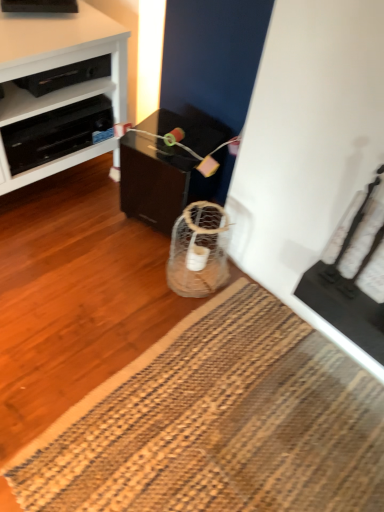
The image size is (384, 512). In order to click on free spot in front of black glossy table at center in this screenshot , I will do `click(121, 273)`.